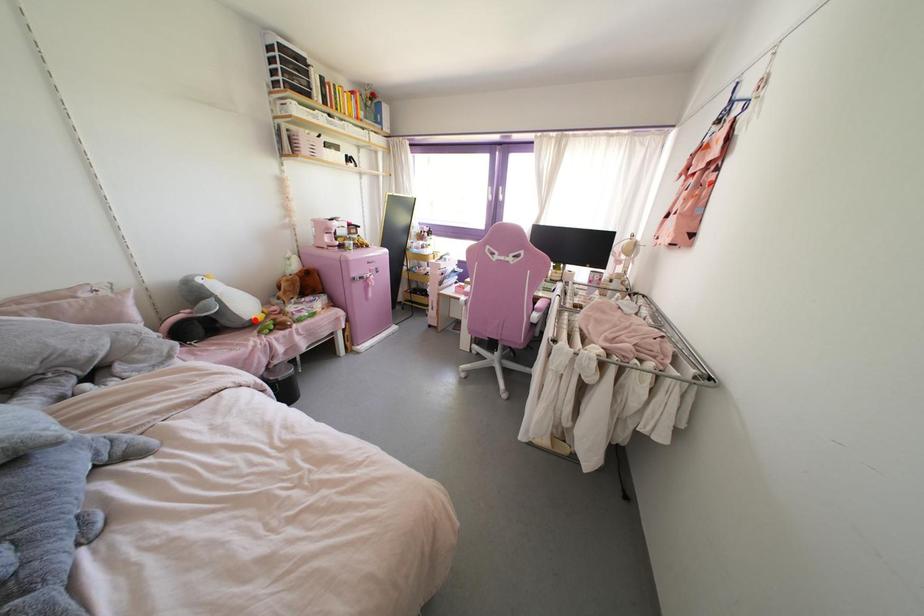
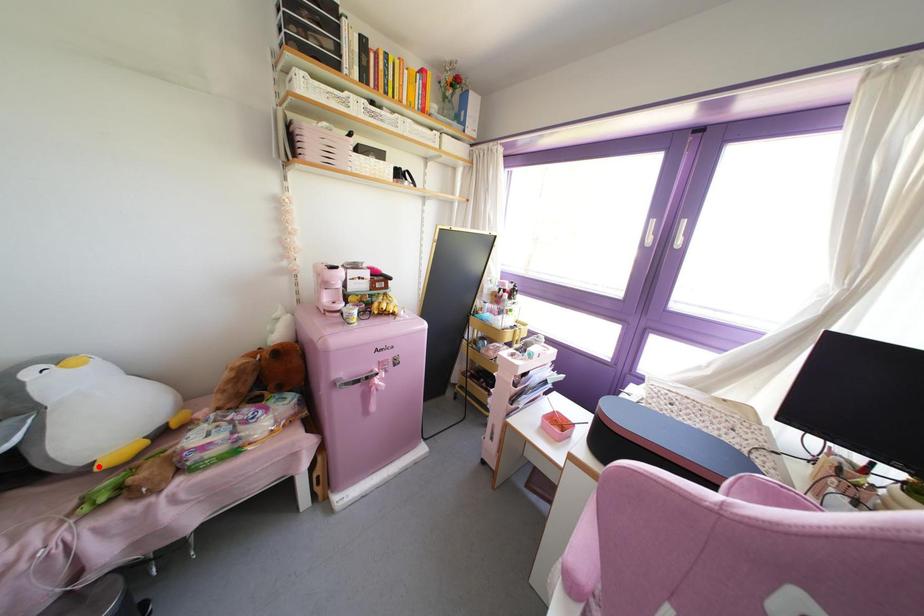
I am providing you with two images of the same scene from different viewpoints. A red point is marked on the first image and another point is marked on the second image. Is the marked point in image1 the same physical position as the marked point in image2?

Yes